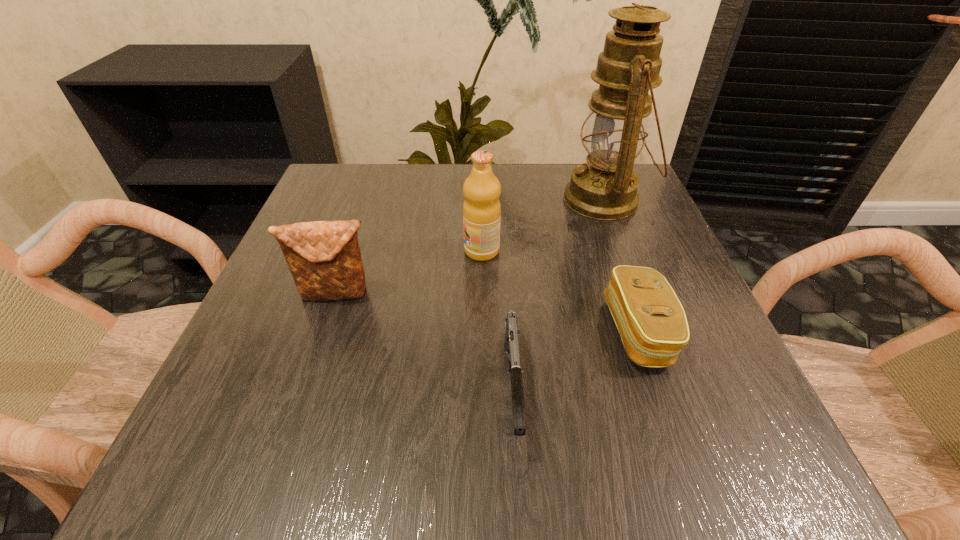
This screenshot has height=540, width=960. Identify the location of free region that satisfies the following two spatial constraints: 1. on the front label of the fruit juice; 2. on the open side of the third tallest object. (482, 294).